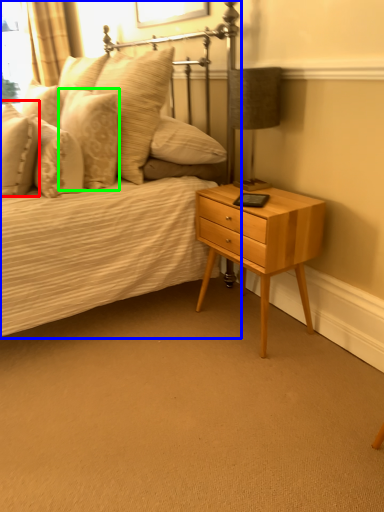
Question: Which object is positioned closest to pillow (highlighted by a red box)? Select from bed (highlighted by a blue box) and pillow (highlighted by a green box).

Choices:
 (A) bed
 (B) pillow

Answer: (B)